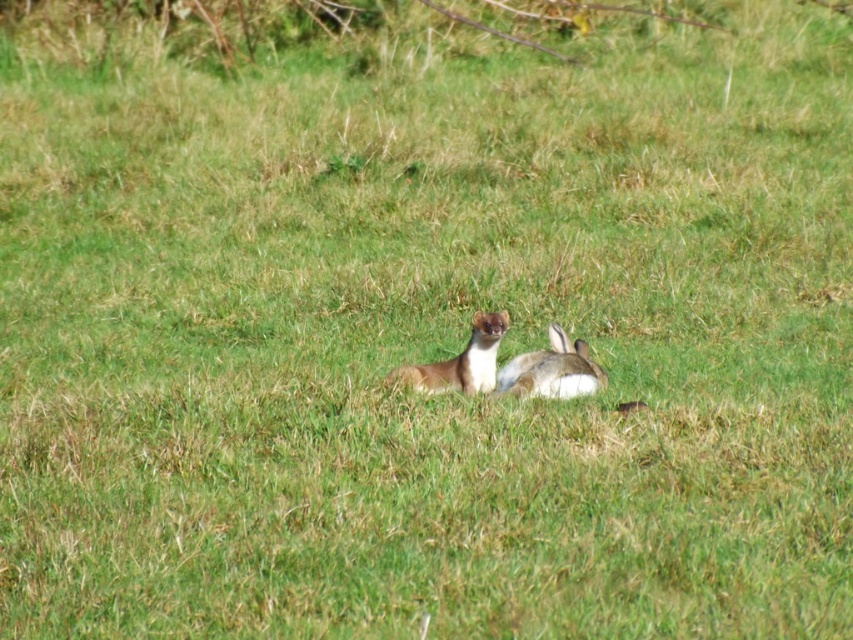
You are a photographer standing in the grassy field. You want to take a clear photo of both the furry white rabbit at center and the furry brown animal at center. Which animal should you focus on first to ensure both are in focus?

A: You should focus on the furry brown animal at center first because it is farther away from the viewer than the furry white rabbit at center. By focusing on the farther animal, both will be in focus due to the depth of field.

You are a photographer standing in the grassy field and want to take a photo of both animals. You notice two points marked in the scene. One is at point (606, 376) and the other at point (422, 376). Which point is closer to your camera position?

Point (422, 376) is closer to the camera position because it is less further than point (606, 376).